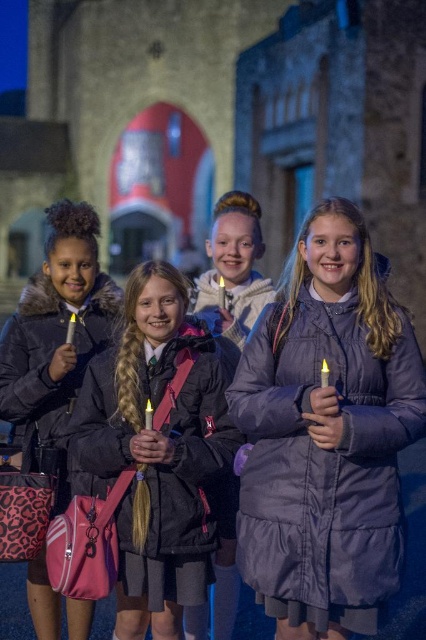
Question: Which object is closer to the camera taking this photo?

Choices:
 (A) purple puffy coat at center
 (B) black matte jacket at center
 (C) matte purple coat at center

Answer: (A)

Question: Does black matte jacket at center have a smaller size compared to matte purple coat at center?

Choices:
 (A) no
 (B) yes

Answer: (A)

Question: Can you confirm if black matte jacket at center is wider than matte purple coat at center?

Choices:
 (A) no
 (B) yes

Answer: (B)

Question: Considering the relative positions of purple puffy coat at center and black matte jacket at center in the image provided, where is purple puffy coat at center located with respect to black matte jacket at center?

Choices:
 (A) above
 (B) below

Answer: (A)

Question: Among these points, which one is farthest from the camera?

Choices:
 (A) [x=239, y=408]
 (B) [x=244, y=314]
 (C) [x=161, y=364]

Answer: (B)

Question: Based on their relative distances, which object is nearer to the matte purple coat at center?

Choices:
 (A) black matte jacket at center
 (B) purple puffy coat at center

Answer: (A)